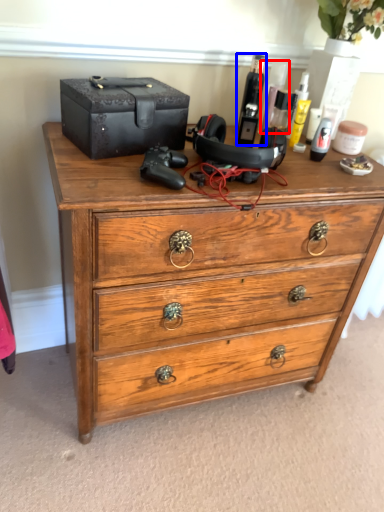
Question: Which point is closer to the camera, toiletry (highlighted by a red box) or toiletry (highlighted by a blue box)?

Choices:
 (A) toiletry
 (B) toiletry

Answer: (B)